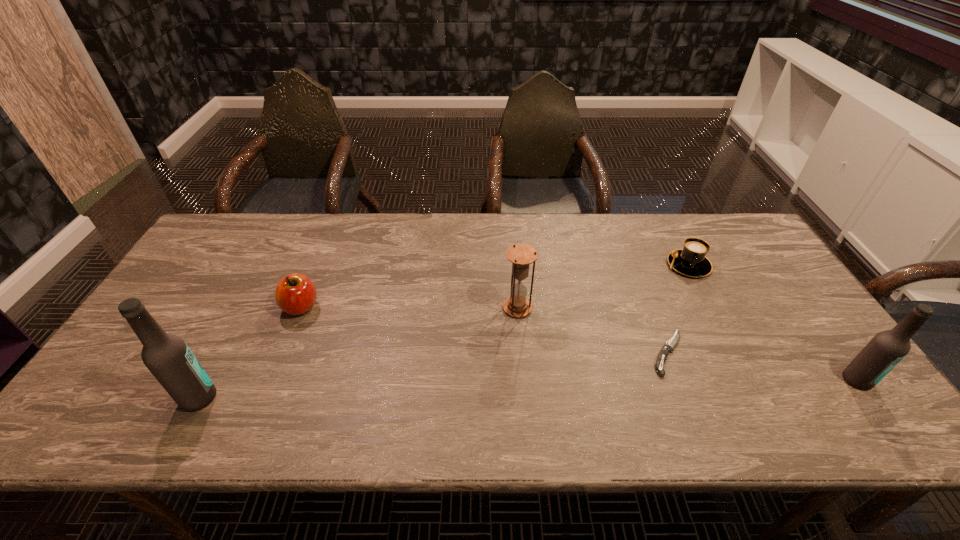
Please point a space for a new beer_bottle to maintain equal intervals. Please provide its 2D coordinates. Your answer should be formatted as a tuple, i.e. [(x, y)], where the tuple contains the x and y coordinates of a point satisfying the conditions above.

[(534, 389)]